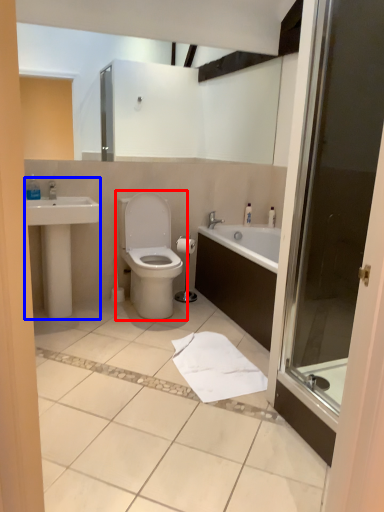
Question: Which point is further to the camera, toilet (highlighted by a red box) or sink (highlighted by a blue box)?

Choices:
 (A) toilet
 (B) sink

Answer: (A)